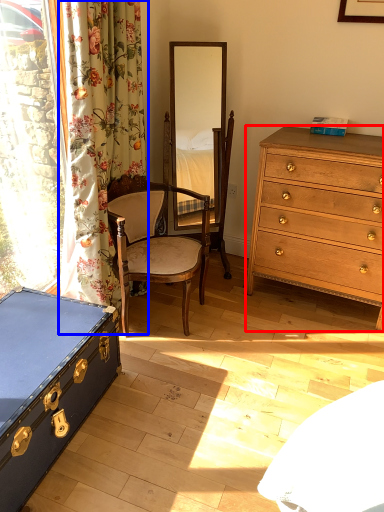
Question: Which object is closer to the camera taking this photo, chest of drawers (highlighted by a red box) or curtain (highlighted by a blue box)?

Choices:
 (A) chest of drawers
 (B) curtain

Answer: (B)